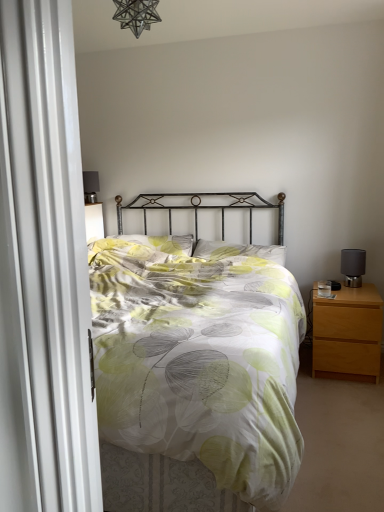
Locate an element on the screen. This screenshot has width=384, height=512. vacant point above light brown wood nightstand at right (from a real-world perspective) is located at coordinates (349, 288).